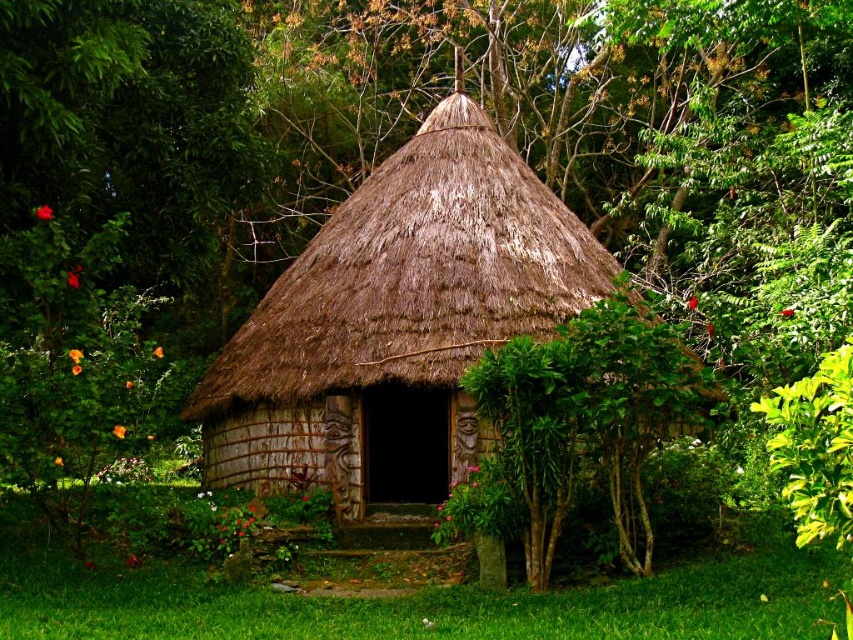
You are a delivery person carrying a package that is 5 meters long. You need to place it between the brown thatched hut at center and the green leafy bush at center. Is there enough space between them to fit the package?

The brown thatched hut at center is 4.25 meters away from the green leafy bush at center. Since the package is 5 meters long, it cannot be placed between them as the distance is shorter than the package length.

You are standing at the base of the steps leading to the brown thatched hut at center. Looking up, you see the green leafy bush at center. Which object is higher in elevation?

The brown thatched hut at center is higher in elevation than the green leafy bush at center because the description states that the brown thatched hut at center is above the green leafy bush at center.

Based on the scene description, what is the 2D coordinate position of the brown thatched hut at center?

The brown thatched hut at center is located at the 2D coordinate point of (x=396, y=323).